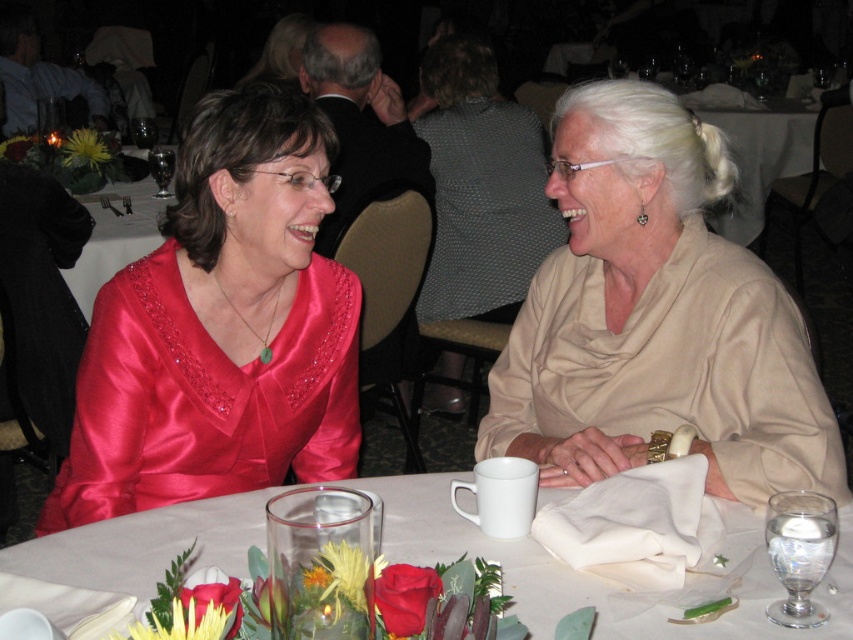
You are a photographer at the event and need to capture a closeup of the beige satin blouse at right and the white matte napkin at lower center. Which object should you focus on first if you want to ensure both are in focus without adjusting the camera settings?

The beige satin blouse at right has a greater height compared to the white matte napkin at lower center, so focusing on the beige satin blouse at right first would ensure both are in focus since it is larger and requires more detailed focus.

You are a photographer at a formal event and need to ensure that the beige satin blouse at right and the satin dress at left are in focus simultaneously. Given that your camera has a depth of field that can cover 18 inches, will both items be in focus?

The distance between the beige satin blouse at right and the satin dress at left is 18.23 inches. Since the camera can cover 18 inches, the slight excess of 0.23 inches means the depth of field might not fully capture both in focus. Adjust the camera settings or position to ensure alignment within the 18 inch range.

You are a photographer at a formal event and need to capture a closeup of the satin dress at left without including the white matte napkin at lower center in the frame. Based on their positions, is this possible?

The satin dress at left is located above the white matte napkin at lower center, so it is possible to capture a closeup of the satin dress at left without including the napkin by focusing on the upper part of the frame where the dress is positioned.